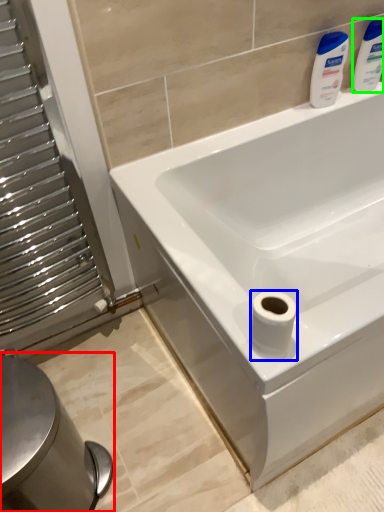
Question: Which object is the farthest from bidet (highlighted by a red box)? Choose among these: toilet paper (highlighted by a blue box) or cleaning product (highlighted by a green box).

Choices:
 (A) toilet paper
 (B) cleaning product

Answer: (B)